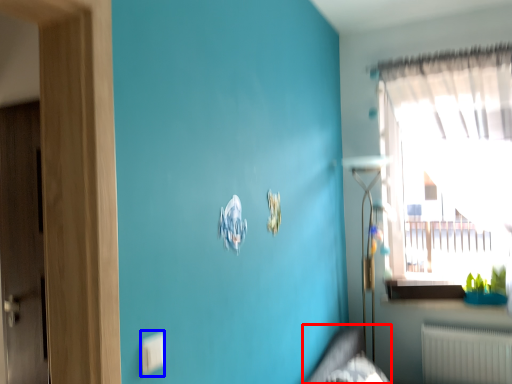
Question: Which point is closer to the camera, bed frame (highlighted by a red box) or electric outlet (highlighted by a blue box)?

Choices:
 (A) bed frame
 (B) electric outlet

Answer: (B)